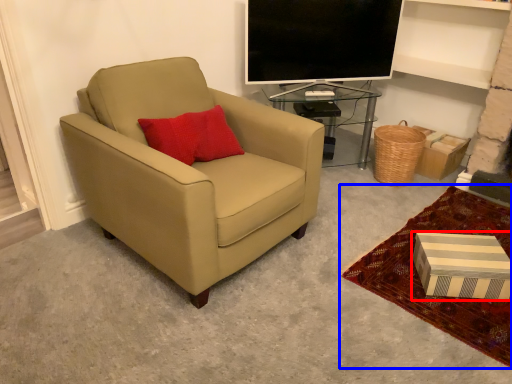
Question: Among these objects, which one is farthest to the camera, box (highlighted by a red box) or plain (highlighted by a blue box)?

Choices:
 (A) box
 (B) plain

Answer: (A)